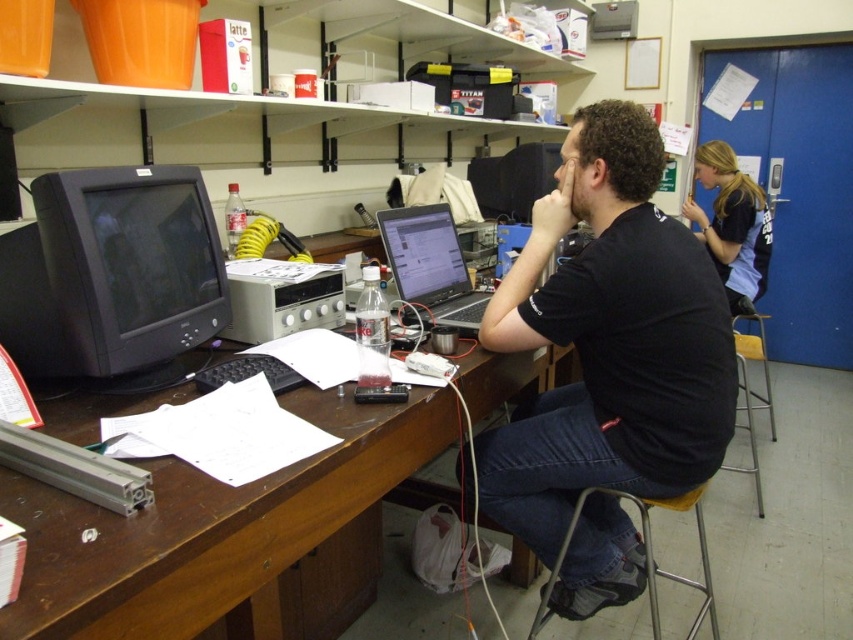
You need to place a large textbook on the desk. Given the objects present on the brown wood computer desk at center and the silver metallic laptop at center, which object should you move to make space?

The brown wood computer desk at center is bigger than the silver metallic laptop at center, so you should move the silver metallic laptop at center to make space for the textbook.